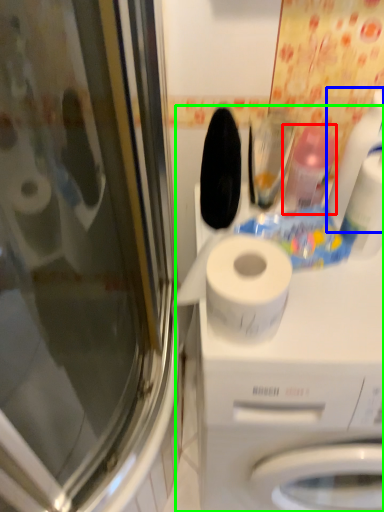
Question: Which object is the farthest from cleaning product (highlighted by a red box)? Choose among these: cleaning product (highlighted by a blue box) or machine (highlighted by a green box).

Choices:
 (A) cleaning product
 (B) machine

Answer: (B)